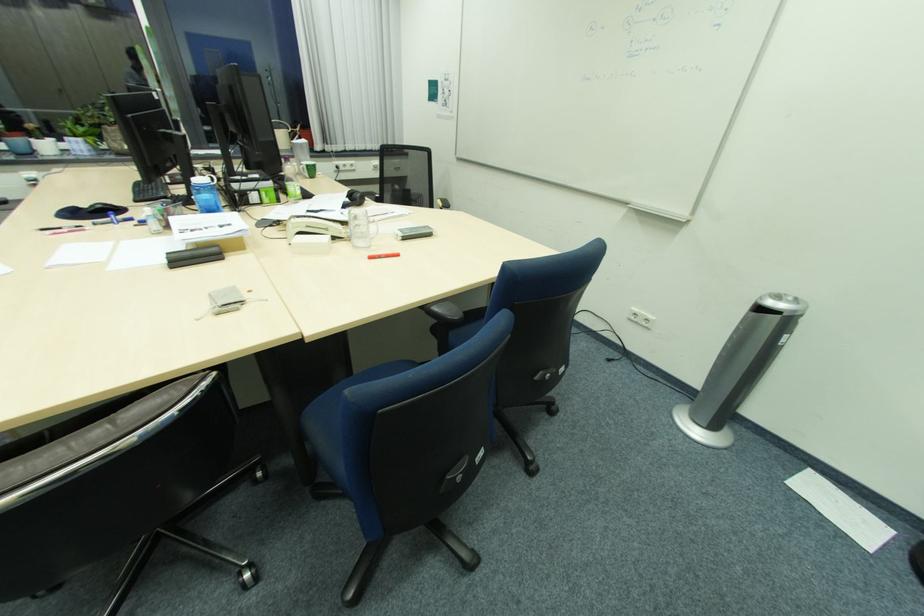
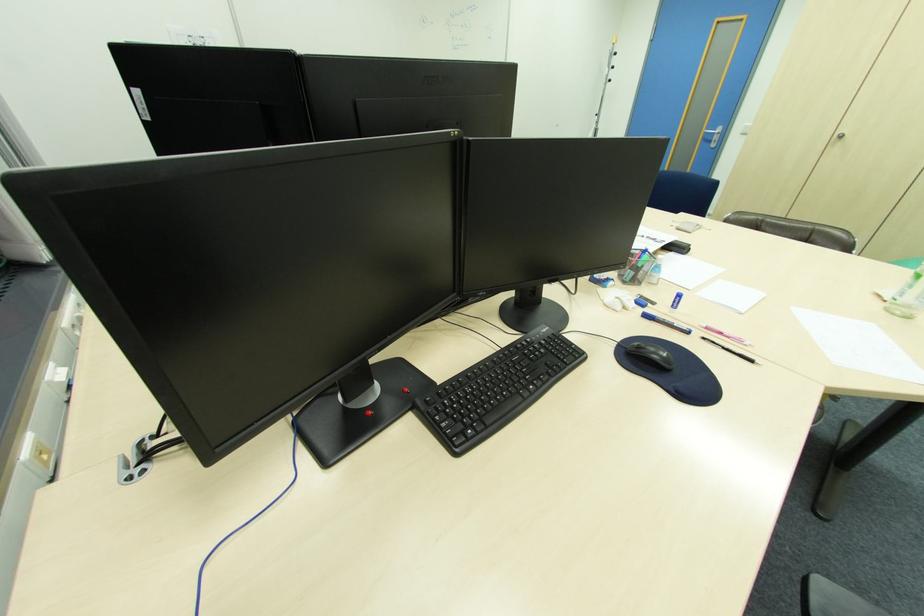
Question: I am providing you with two images of the same scene from different viewpoints. Which of the following objects are not visible in image2?

Choices:
 (A) whiteboard magnet
 (B) black pencil
 (C) metal door handle
 (D) blue chair sitting surface

Answer: (D)